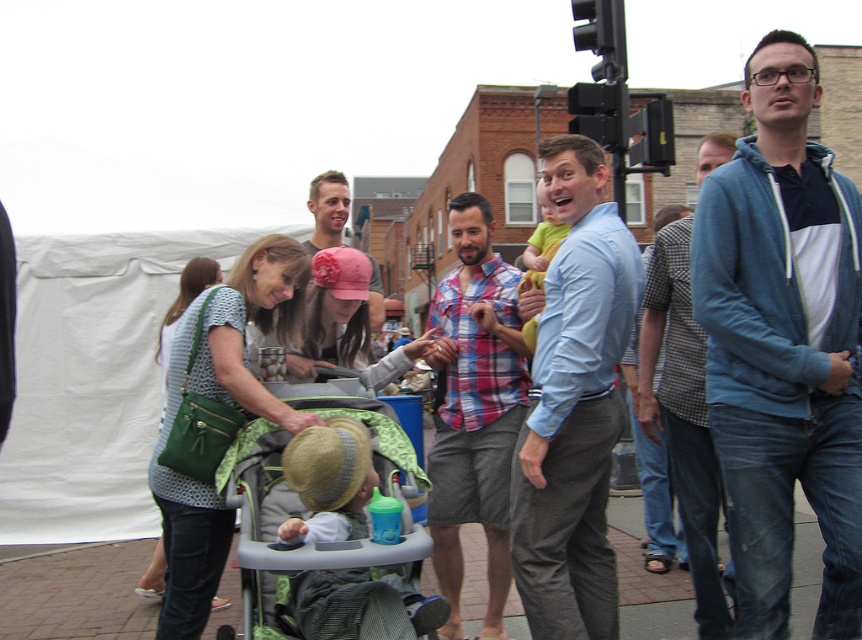
You are a delivery person carrying a package that is 1.5 meters long. You need to navigate through the space between the blue fleece jacket at upper right and the green fabric stroller at center. Can your package fit through the space between them without bending?

The blue fleece jacket at upper right and green fabric stroller at center are 1.32 meters apart from each other. Since the package is 1.5 meters long, it is longer than the available space. Therefore, the package cannot fit through the space between them without bending.

You are a photographer trying to capture a candid shot of the plaid shirt at center without including the blue fleece jacket at upper right. Given their heights, is this possible from your current position?

The blue fleece jacket at upper right is much taller than the plaid shirt at center. Since the jacket is taller, it might block the view of the plaid shirt at center unless you adjust your angle or move closer to lower your perspective.